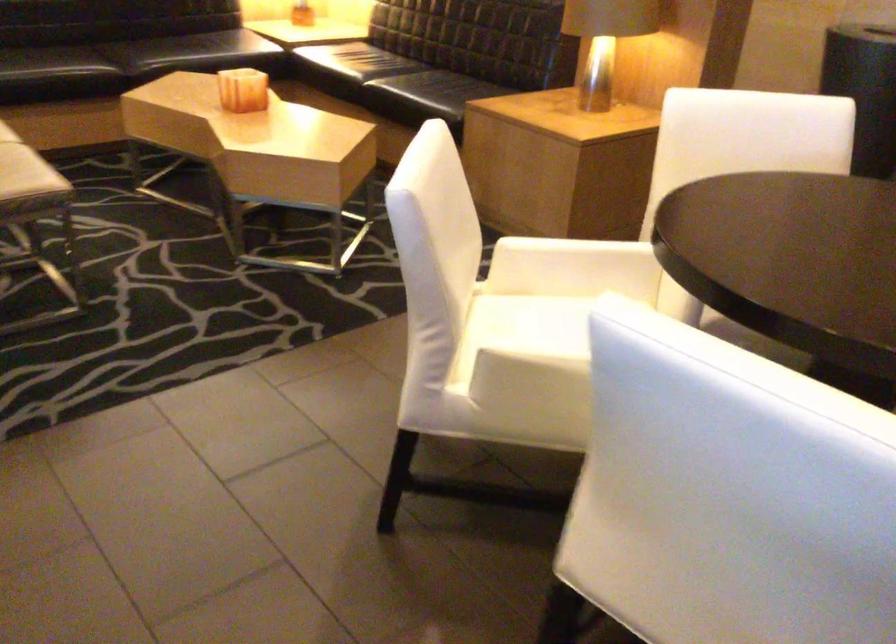
Which object does [243,90] point to?

It refers to a orange candle holder.